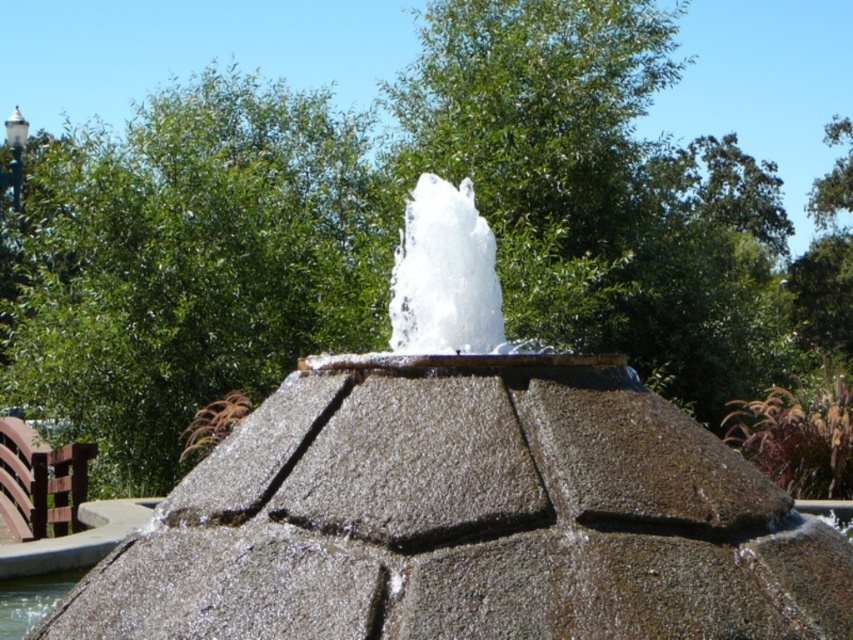
Question: Which point appears farthest from the camera in this image?

Choices:
 (A) (474, 285)
 (B) (426, 237)

Answer: (B)

Question: Is gray stone fountain at center bigger than clear water at fountain center?

Choices:
 (A) no
 (B) yes

Answer: (B)

Question: Among these points, which one is nearest to the camera?

Choices:
 (A) (148, 531)
 (B) (428, 320)
 (C) (62, 586)

Answer: (A)

Question: Which of the following is the closest to the observer?

Choices:
 (A) (0, 627)
 (B) (488, 288)
 (C) (184, 614)

Answer: (C)

Question: Does gray stone fountain at center appear on the left side of white frothy water at center?

Choices:
 (A) yes
 (B) no

Answer: (B)

Question: Is gray stone fountain at center above clear water at fountain center?

Choices:
 (A) yes
 (B) no

Answer: (A)